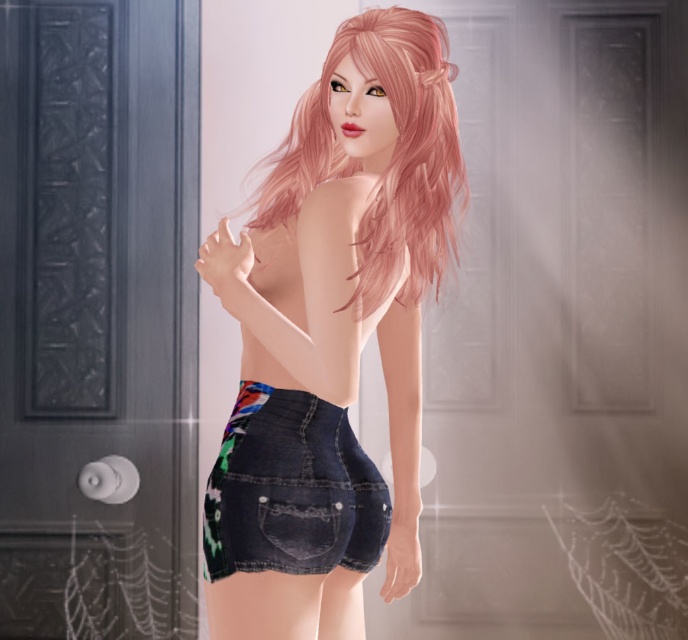
Question: Does denim shorts at center appear under denim shorts at lower center?

Choices:
 (A) yes
 (B) no

Answer: (B)

Question: Which object is the farthest from the pink wavy hair at back?

Choices:
 (A) denim shorts at lower center
 (B) denim shorts at center

Answer: (A)

Question: Is denim shorts at center positioned before pink wavy hair at back?

Choices:
 (A) no
 (B) yes

Answer: (B)

Question: From the image, what is the correct spatial relationship of denim shorts at center in relation to pink wavy hair at back?

Choices:
 (A) above
 (B) below

Answer: (B)

Question: Which point is farther to the camera?

Choices:
 (A) pink wavy hair at back
 (B) denim shorts at center

Answer: (A)

Question: Which object appears closest to the camera in this image?

Choices:
 (A) denim shorts at center
 (B) pink wavy hair at back
 (C) denim shorts at lower center

Answer: (A)